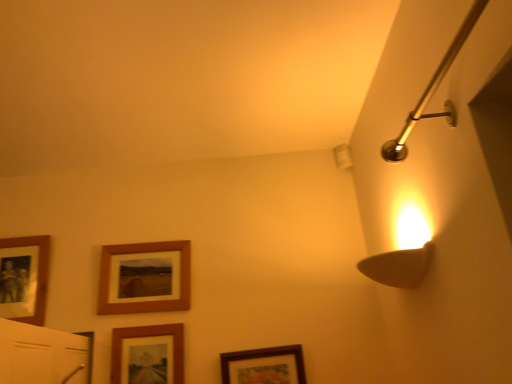
Question: From a real-world perspective, is wooden framed picture at lower center, arranged as the 3th picture frame when viewed from the left, above or below wooden framed picture at lower center, placed as the first picture frame when sorted from right to left?

Choices:
 (A) below
 (B) above

Answer: (B)

Question: Visually, is wooden framed picture at lower center, arranged as the 3th picture frame when viewed from the left, positioned to the left or to the right of wooden framed picture at lower center, placed as the 4th picture frame when sorted from left to right?

Choices:
 (A) right
 (B) left

Answer: (B)

Question: Based on their relative distances, which object is farther from the wooden framed picture at lower center, placed as the 4th picture frame when sorted from left to right?

Choices:
 (A) wooden photo frame at left, the 1th picture frame positioned from the left
 (B) polished brass shower arm at upper right
 (C) wooden framed picture at lower center, arranged as the 3th picture frame when viewed from the left
 (D) wooden picture frame at center, the second picture frame in the left-to-right sequence

Answer: (B)

Question: Based on their relative distances, which object is nearer to the polished brass shower arm at upper right?

Choices:
 (A) wooden photo frame at left, acting as the fourth picture frame starting from the right
 (B) wooden picture frame at center, which ranks as the 3th picture frame in right-to-left order
 (C) wooden framed picture at lower center, placed as the 4th picture frame when sorted from left to right
 (D) wooden framed picture at lower center, arranged as the 2th picture frame when viewed from the right

Answer: (C)